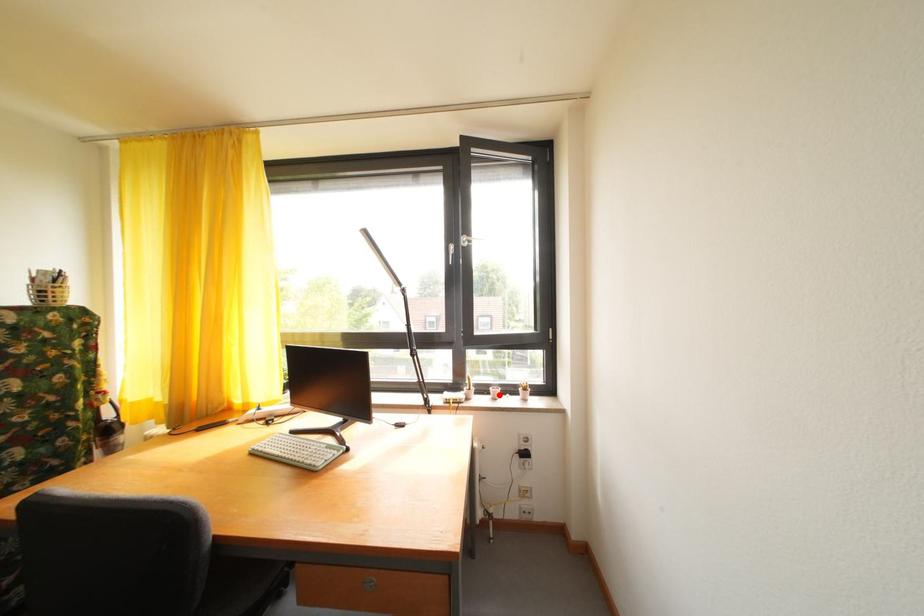
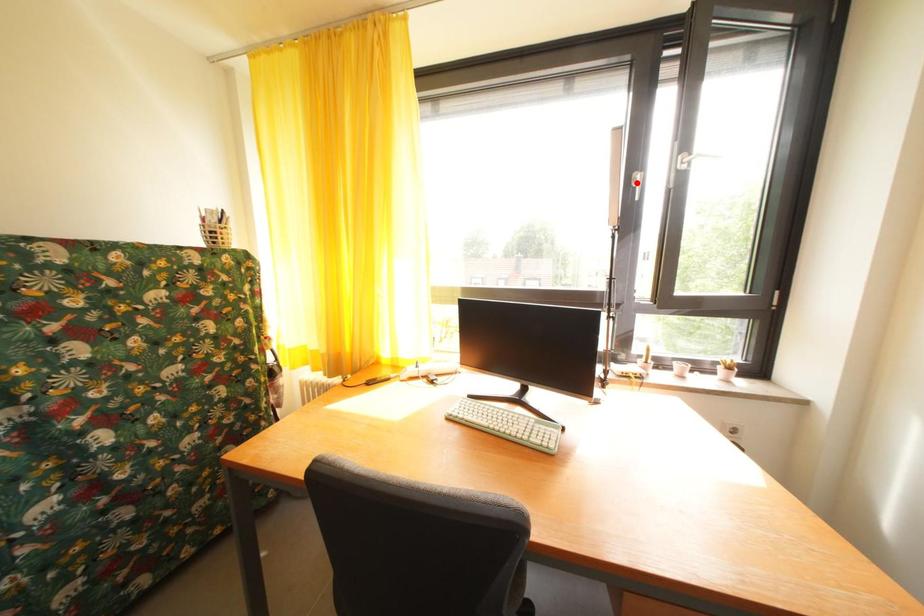
I am providing you with two images of the same scene from different viewpoints. A red point is marked on the first image and another point is marked on the second image. Do the highlighted points in image1 and image2 indicate the same real-world spot?

No